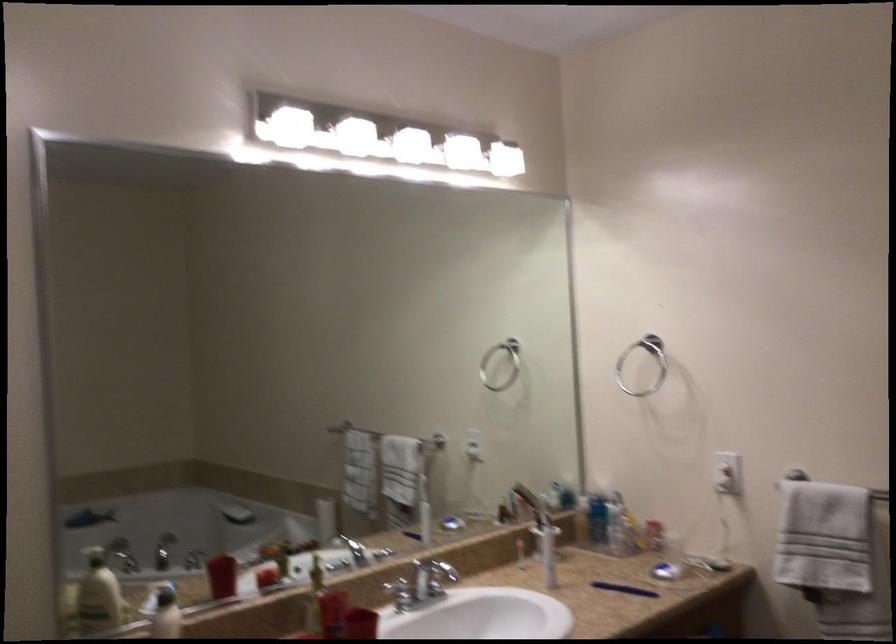
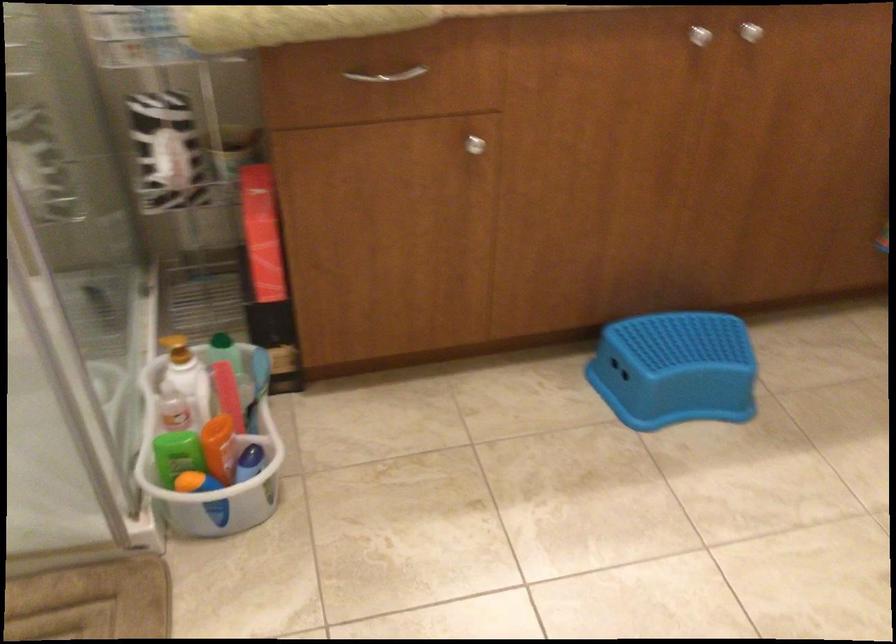
Based on the continuous images, in which direction is the camera rotating?

The camera's rotation is toward left-down.